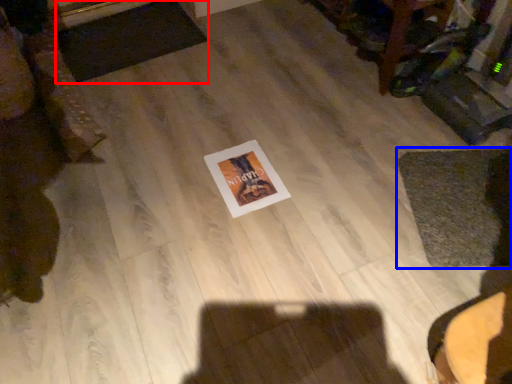
Question: Which point is closer to the camera, mat (highlighted by a red box) or mat (highlighted by a blue box)?

Choices:
 (A) mat
 (B) mat

Answer: (B)